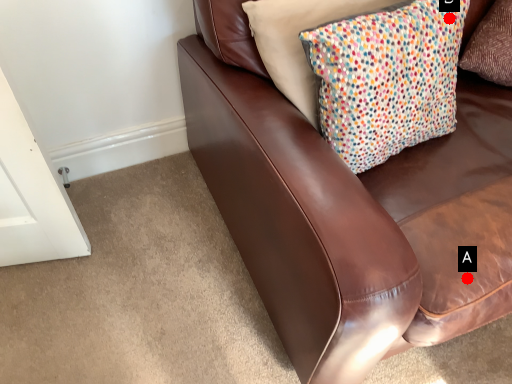
Question: Two points are circled on the image, labeled by A and B beside each circle. Which point is farther to the camera?

Choices:
 (A) A is further
 (B) B is further

Answer: (B)